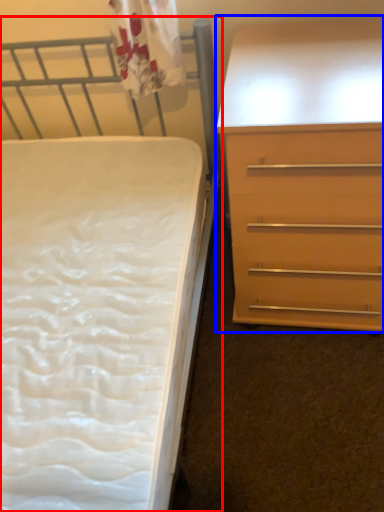
Question: Which object appears closest to the camera in this image, bed (highlighted by a red box) or chest of drawers (highlighted by a blue box)?

Choices:
 (A) bed
 (B) chest of drawers

Answer: (A)